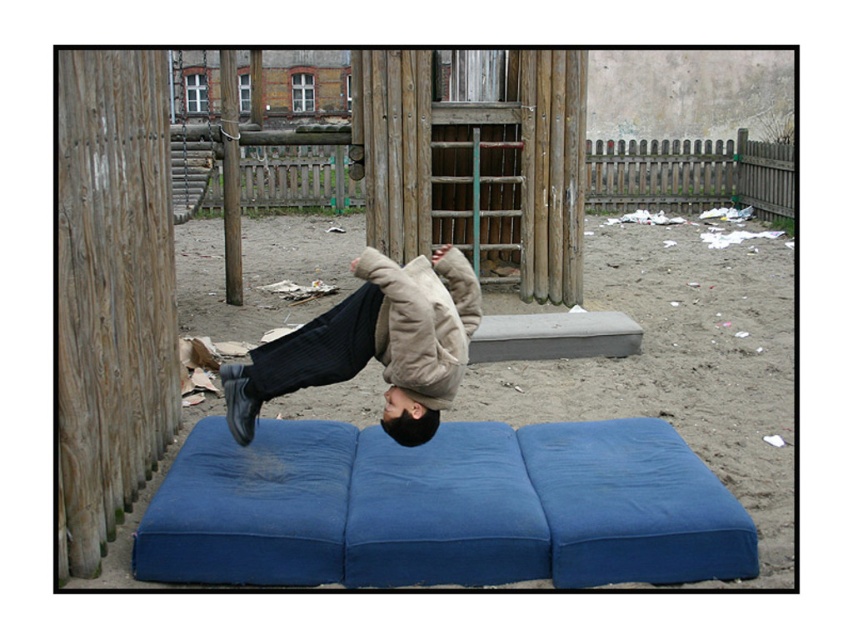
You are standing at the point labeled point (213, 160) in the playground scene. You want to throw a ball to the point labeled point (743, 496). Will the ball travel forward from your position?

Yes, the ball will travel forward from your position because point (743, 496) is in front of point (213, 160).

You are a photographer trying to capture the scene where the person is doing a backflip. Based on the image, which object, the sandy brown sand at center or the beige woolen jacket at center, is positioned higher in the frame?

The sandy brown sand at center is located above the beige woolen jacket at center, so it is positioned higher in the frame.

You are a photographer trying to capture both the beige woolen jacket at center and the brushed metal swing at upper center in a single frame. Which object should you focus on first to ensure both are in the frame?

The beige woolen jacket at center is shorter than the brushed metal swing at upper center. To ensure both are in the frame, focus on the shorter object first, which is the beige woolen jacket at center, then adjust to include the taller brushed metal swing at upper center.